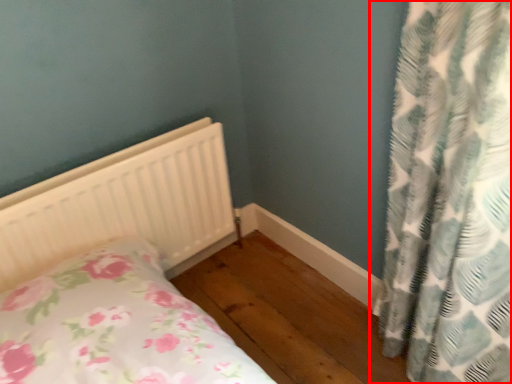
Question: From the image's perspective, what is the correct spatial relationship of curtain (annotated by the red box) in relation to bed?

Choices:
 (A) above
 (B) below

Answer: (B)